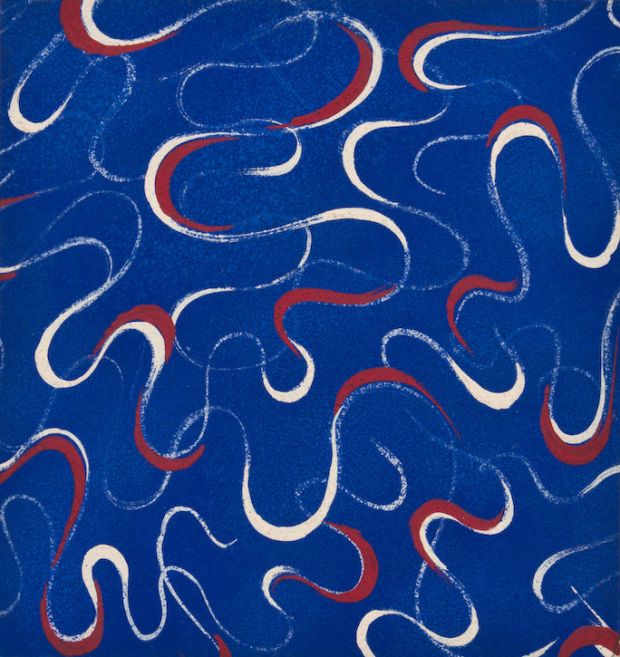
Where is `abstract painting`? Image resolution: width=620 pixels, height=657 pixels. abstract painting is located at coordinates (290, 395).